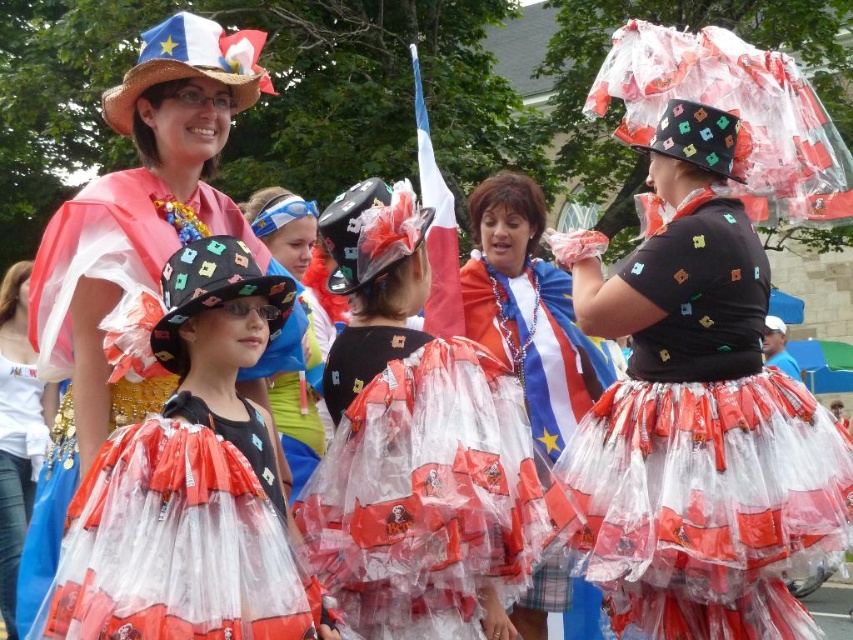
Does shiny plastic skirt at center appear under translucent plastic dress at center?

No.

Is point (614, 376) behind point (352, 196)?

That is True.

Identify the location of shiny plastic skirt at center. The width and height of the screenshot is (853, 640). (527, 310).

This screenshot has height=640, width=853. In order to click on shiny plastic skirt at center in this screenshot , I will do `click(527, 310)`.

Does shiny plastic dress at center appear on the left side of matte black hat at upper left?

In fact, shiny plastic dress at center is to the right of matte black hat at upper left.

Does point (129, 433) come in front of point (20, 324)?

Yes.

Where is `shiny plastic dress at center`? The height and width of the screenshot is (640, 853). shiny plastic dress at center is located at coordinates (186, 461).

Does matte plastic dress at center appear on the left side of shiny plastic dress at center?

Incorrect, matte plastic dress at center is not on the left side of shiny plastic dress at center.

Measure the distance between point (x=688, y=232) and camera.

41.70 meters

Find the location of `matte plastic dress at center`. matte plastic dress at center is located at coordinates (698, 413).